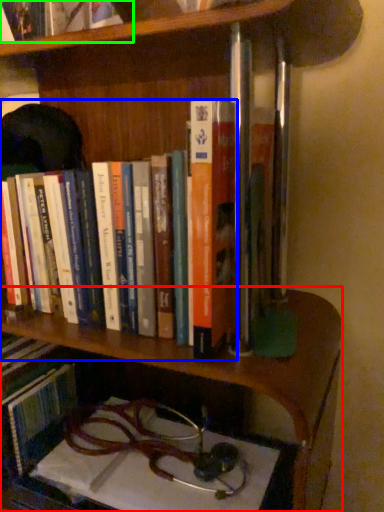
Question: Estimate the real-world distances between objects in this image. Which object is closer to shelf (highlighted by a red box), book (highlighted by a blue box) or book (highlighted by a green box)?

Choices:
 (A) book
 (B) book

Answer: (A)